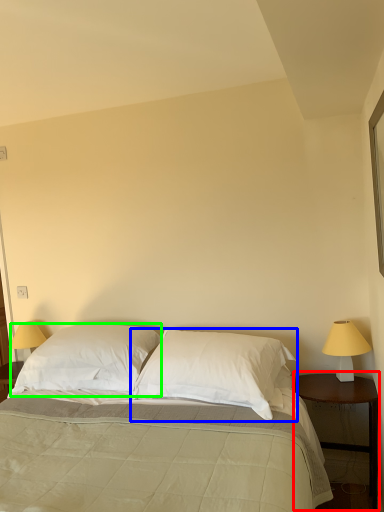
Question: Which object is the farthest from nightstand (highlighted by a red box)? Choose among these: pillow (highlighted by a blue box) or pillow (highlighted by a green box).

Choices:
 (A) pillow
 (B) pillow

Answer: (B)